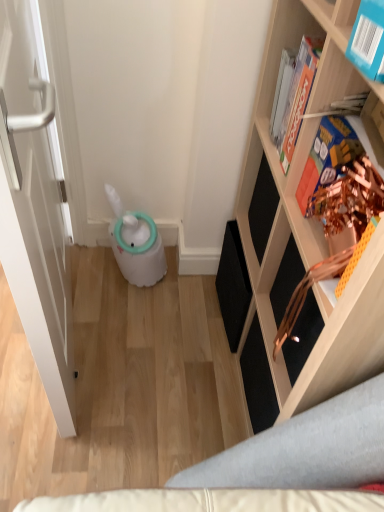
This screenshot has width=384, height=512. What do you see at coordinates (298, 98) in the screenshot? I see `hardcover book at upper right, which ranks as the third book in front-to-back order` at bounding box center [298, 98].

This screenshot has height=512, width=384. Describe the element at coordinates (35, 214) in the screenshot. I see `white matte door at left` at that location.

At what (x,y) coordinates should I click in order to perform the action: click on wooden shelf at right. Please return your answer as a coordinate pair (x, y). Looking at the image, I should click on (302, 241).

In order to click on blue cardboard book at upper right, acting as the third book starting from the back in this screenshot , I will do `click(368, 40)`.

Image resolution: width=384 pixels, height=512 pixels. I want to click on the 3rd book above the white matte door at left (from the image's perspective), so (298, 98).

From a real-world perspective, which object rests below the other?

white matte door at left is physically lower.

Is point (303, 49) farther from camera compared to point (15, 260)?

Yes.

This screenshot has width=384, height=512. There is a white matte door at left. What are the coordinates of `the 3rd book above it (from the image's perspective)` in the screenshot? It's located at (298, 98).

Which is behind, white matte door at left or hardcover book at upper right, the 1th book when ordered from back to front?

hardcover book at upper right, the 1th book when ordered from back to front, is more distant.

From a real-world perspective, is white matte door at left above or below hardcover book at upper right, the 1th book when ordered from back to front?

In terms of real-world spatial position, white matte door at left is below hardcover book at upper right, the 1th book when ordered from back to front.

From the image's perspective, between white matte door at left and hardcover book at upper right, the 1th book when ordered from back to front, which one is located above?

hardcover book at upper right, the 1th book when ordered from back to front, appears higher in the image.

Would you consider white matte door at left to be distant from blue cardboard book at upper right, which is counted as the first book, starting from the front?

white matte door at left is actually quite close to blue cardboard book at upper right, which is counted as the first book, starting from the front.

Is point (35, 127) closer or farther from the camera than point (346, 48)?

Point (35, 127) is positioned farther from the camera compared to point (346, 48).

Is white matte door at left facing away from blue cardboard book at upper right, which is counted as the first book, starting from the front?

Absolutely, white matte door at left is directed away from blue cardboard book at upper right, which is counted as the first book, starting from the front.

Consider the image. Considering the sizes of wooden shelf at right and blue cardboard book at upper right, which is counted as the first book, starting from the front, in the image, is wooden shelf at right bigger or smaller than blue cardboard book at upper right, which is counted as the first book, starting from the front,?

In the image, wooden shelf at right appears to be larger than blue cardboard book at upper right, which is counted as the first book, starting from the front.

Would you say wooden shelf at right is inside or outside blue cardboard book at upper right, which is counted as the first book, starting from the front?

wooden shelf at right is spatially situated outside blue cardboard book at upper right, which is counted as the first book, starting from the front.

From the picture: Is wooden shelf at right positioned far away from blue cardboard book at upper right, which is counted as the first book, starting from the front?

No, wooden shelf at right is not far from blue cardboard book at upper right, which is counted as the first book, starting from the front.

Is wooden shelf at right to the right of blue cardboard book at upper right, which is counted as the first book, starting from the front, from the viewer's perspective?

Yes.

Locate an element on the screen. The height and width of the screenshot is (512, 384). book that is the 2nd one when counting forward from the hardcover book at upper right, the 1th book when ordered from back to front is located at coordinates (368, 40).

Between blue cardboard book at upper right, which is counted as the first book, starting from the front, and hardcover book at upper right, which ranks as the third book in front-to-back order, which one is positioned behind?

Positioned behind is hardcover book at upper right, which ranks as the third book in front-to-back order.

From a real-world perspective, is blue cardboard book at upper right, acting as the third book starting from the back, positioned above or below hardcover book at upper right, which ranks as the third book in front-to-back order?

In terms of real-world spatial position, blue cardboard book at upper right, acting as the third book starting from the back, is above hardcover book at upper right, which ranks as the third book in front-to-back order.

Is blue cardboard book at upper right, acting as the third book starting from the back, positioned with its back to hardcover book at upper right, the 1th book when ordered from back to front?

blue cardboard book at upper right, acting as the third book starting from the back, is not turned away from hardcover book at upper right, the 1th book when ordered from back to front.

Is hardcover book at upper right, which ranks as the third book in front-to-back order, far away from blue cardboard book at upper right, acting as the third book starting from the back?

hardcover book at upper right, which ranks as the third book in front-to-back order, is near blue cardboard book at upper right, acting as the third book starting from the back, not far away.

Does hardcover book at upper right, which ranks as the third book in front-to-back order, have a smaller size compared to blue cardboard book at upper right, acting as the third book starting from the back?

Correct, hardcover book at upper right, which ranks as the third book in front-to-back order, occupies less space than blue cardboard book at upper right, acting as the third book starting from the back.

Considering the relative positions of hardcover book at upper right, which ranks as the third book in front-to-back order, and blue cardboard book at upper right, acting as the third book starting from the back, in the image provided, is hardcover book at upper right, which ranks as the third book in front-to-back order, in front of blue cardboard book at upper right, acting as the third book starting from the back,?

No, it is not.

From a real-world perspective, is hardcover book at upper right, which ranks as the third book in front-to-back order, positioned under blue cardboard book at upper right, which is counted as the first book, starting from the front, based on gravity?

Indeed, from a real-world perspective, hardcover book at upper right, which ranks as the third book in front-to-back order, is positioned beneath blue cardboard book at upper right, which is counted as the first book, starting from the front.

Could you tell me if blue cardboard book at upper right, which is counted as the first book, starting from the front, is facing metallic gold book at upper right, the second book when ordered from back to front?

No.

Considering the positions of objects blue cardboard book at upper right, which is counted as the first book, starting from the front, and metallic gold book at upper right, the second book when ordered from back to front, in the image provided, who is in front, blue cardboard book at upper right, which is counted as the first book, starting from the front, or metallic gold book at upper right, the second book when ordered from back to front,?

Positioned in front is blue cardboard book at upper right, which is counted as the first book, starting from the front.

Which is behind, point (351, 42) or point (346, 156)?

The point (346, 156) is farther from the camera.

Are blue cardboard book at upper right, acting as the third book starting from the back, and metallic gold book at upper right, the 2th book when ordered from front to back, making contact?

No.

Where is `door below the hardcover book at upper right, the 1th book when ordered from back to front (from the image's perspective)`? The height and width of the screenshot is (512, 384). door below the hardcover book at upper right, the 1th book when ordered from back to front (from the image's perspective) is located at coordinates (35, 214).

From a real-world perspective, count 2nd books upward from the white matte door at left and point to it. Please provide its 2D coordinates.

[(298, 98)]

Which object lies further to the anchor point wooden shelf at right, blue cardboard book at upper right, which is counted as the first book, starting from the front, or hardcover book at upper right, the 1th book when ordered from back to front?

The object further to wooden shelf at right is blue cardboard book at upper right, which is counted as the first book, starting from the front.

Considering their positions, is white matte door at left positioned further to metallic gold book at upper right, the second book when ordered from back to front, than blue cardboard book at upper right, acting as the third book starting from the back?

Based on the image, white matte door at left appears to be further to metallic gold book at upper right, the second book when ordered from back to front.

Based on their spatial positions, is hardcover book at upper right, which ranks as the third book in front-to-back order, or white matte door at left closer to metallic gold book at upper right, the second book when ordered from back to front?

hardcover book at upper right, which ranks as the third book in front-to-back order.

Estimate the real-world distances between objects in this image. Which object is closer to hardcover book at upper right, the 1th book when ordered from back to front, blue cardboard book at upper right, acting as the third book starting from the back, or white matte door at left?

blue cardboard book at upper right, acting as the third book starting from the back.

Based on the photo, looking at the image, which one is located closer to wooden shelf at right, metallic gold book at upper right, the 2th book when ordered from front to back, or white matte door at left?

The object closer to wooden shelf at right is metallic gold book at upper right, the 2th book when ordered from front to back.

When comparing their distances from wooden shelf at right, does hardcover book at upper right, the 1th book when ordered from back to front, or blue cardboard book at upper right, acting as the third book starting from the back, seem closer?

Based on the image, hardcover book at upper right, the 1th book when ordered from back to front, appears to be nearer to wooden shelf at right.

Looking at the image, which one is located further to metallic gold book at upper right, the second book when ordered from back to front, hardcover book at upper right, which ranks as the third book in front-to-back order, or wooden shelf at right?

Among the two, wooden shelf at right is located further to metallic gold book at upper right, the second book when ordered from back to front.

Considering their positions, is white matte door at left positioned further to metallic gold book at upper right, the second book when ordered from back to front, than wooden shelf at right?

A: white matte door at left lies further to metallic gold book at upper right, the second book when ordered from back to front, than the other object.

At what (x,y) coordinates should I click in order to perform the action: click on book situated between white matte door at left and metallic gold book at upper right, the 2th book when ordered from front to back, from left to right. Please return your answer as a coordinate pair (x, y). The image size is (384, 512). Looking at the image, I should click on click(298, 98).

I want to click on book between blue cardboard book at upper right, acting as the third book starting from the back, and hardcover book at upper right, the 1th book when ordered from back to front, along the z-axis, so click(327, 157).

I want to click on book located between wooden shelf at right and metallic gold book at upper right, the 2th book when ordered from front to back, in the depth direction, so click(368, 40).